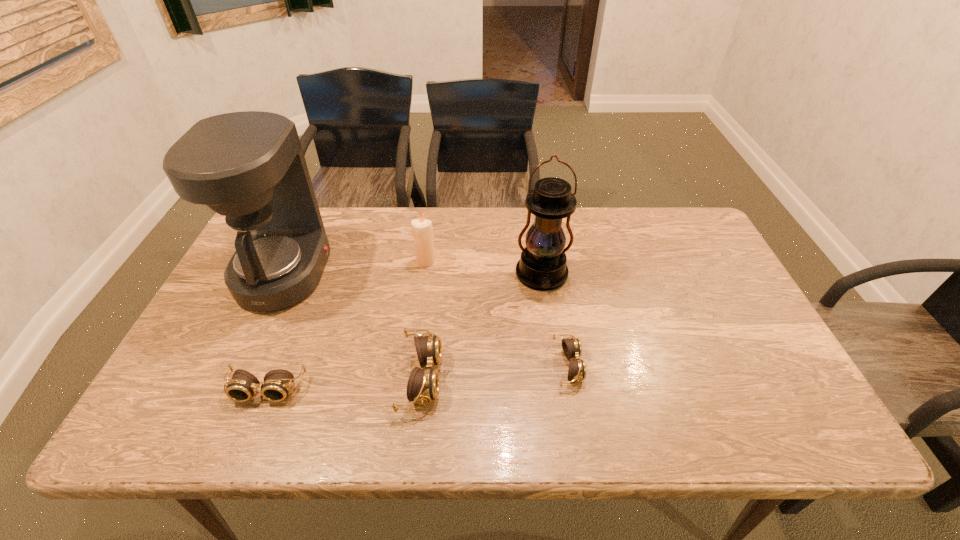
Where is `free point that keeps the goggless evenly spaced on the right`? free point that keeps the goggless evenly spaced on the right is located at coordinates (708, 354).